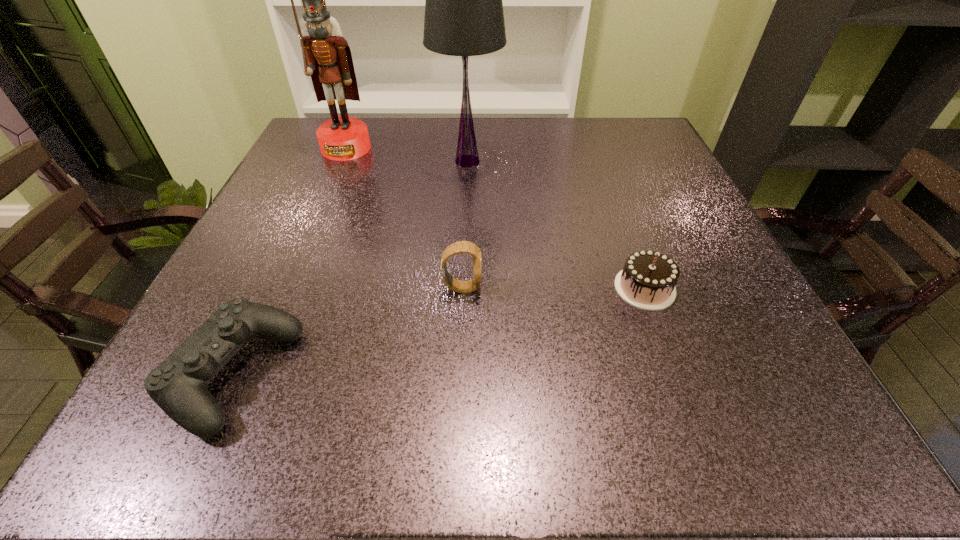
You are a GUI agent. You are given a task and a screenshot of the screen. Output one action in this format:
    pyautogui.click(x=<x>, y=<y>)
    Task: Click on the vacant space at the left edge of the desktop
    The height and width of the screenshot is (540, 960).
    Given the screenshot: What is the action you would take?
    pyautogui.click(x=308, y=223)

You are a GUI agent. You are given a task and a screenshot of the screen. Output one action in this format:
    pyautogui.click(x=<x>, y=<y>)
    Task: Click on the free region at the right edge of the desktop
    This screenshot has height=540, width=960.
    Given the screenshot: What is the action you would take?
    pyautogui.click(x=780, y=390)

You are a GUI agent. You are given a task and a screenshot of the screen. Output one action in this format:
    pyautogui.click(x=<x>, y=<y>)
    Task: Click on the free point at the far left corner
    
    Given the screenshot: What is the action you would take?
    tap(305, 143)

This screenshot has width=960, height=540. In the image, there is a desktop. What are the coordinates of `blank space at the far right corner` in the screenshot? It's located at (647, 125).

Find the location of `empty location between the nutcracker and the fourth shortest object`. empty location between the nutcracker and the fourth shortest object is located at coordinates (407, 155).

At what (x,y) coordinates should I click in order to perform the action: click on empty space that is in between the nutcracker and the rightmost object. Please return your answer as a coordinate pair (x, y). The width and height of the screenshot is (960, 540). Looking at the image, I should click on (495, 218).

Where is `free space between the control and the third tallest object`? free space between the control and the third tallest object is located at coordinates (348, 332).

The height and width of the screenshot is (540, 960). In order to click on free space between the chocolate cake and the third shortest object in this screenshot , I will do `click(553, 288)`.

Locate an element on the screen. This screenshot has height=540, width=960. empty location between the third shortest object and the nutcracker is located at coordinates (404, 218).

Where is `free space between the nutcracker and the control`? free space between the nutcracker and the control is located at coordinates (290, 261).